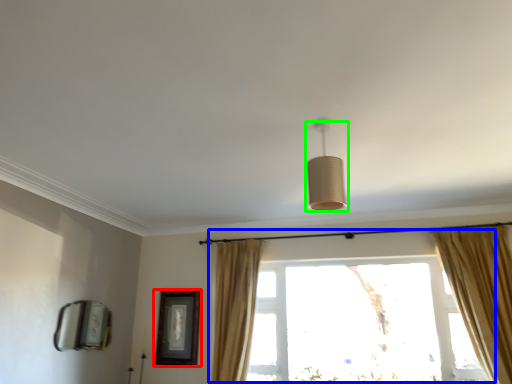
Question: Based on their relative distances, which object is farther from picture frame (highlighted by a red box)? Choose from window (highlighted by a blue box) and lamp (highlighted by a green box).

Choices:
 (A) window
 (B) lamp

Answer: (B)